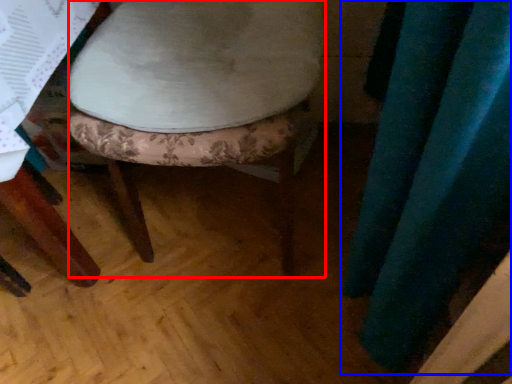
Question: Among these objects, which one is nearest to the camera, stool (highlighted by a red box) or curtain (highlighted by a blue box)?

Choices:
 (A) stool
 (B) curtain

Answer: (B)